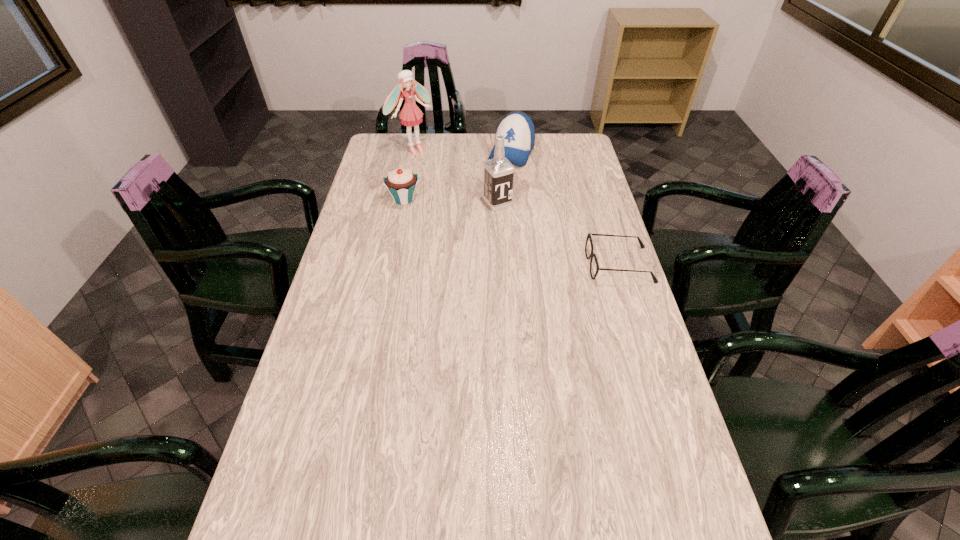
I want to click on vacant space situated on the front-facing side of the baseball cap, so click(x=474, y=232).

At what (x,y) coordinates should I click in order to perform the action: click on free location located on the front-facing side of the baseball cap. Please return your answer as a coordinate pair (x, y). Image resolution: width=960 pixels, height=540 pixels. Looking at the image, I should click on (483, 214).

At what (x,y) coordinates should I click in order to perform the action: click on vacant space located on the front-facing side of the baseball cap. Please return your answer as a coordinate pair (x, y). Looking at the image, I should click on (482, 218).

Where is `blank space located on the front label of the vodka`? The width and height of the screenshot is (960, 540). blank space located on the front label of the vodka is located at coordinates (548, 264).

You are a GUI agent. You are given a task and a screenshot of the screen. Output one action in this format:
    pyautogui.click(x=<x>, y=<y>)
    Task: Click on the free space located 0.390m on the front label of the vodka
    
    Given the screenshot: What is the action you would take?
    click(564, 282)

Find the location of `free space located on the front label of the vodka`. free space located on the front label of the vodka is located at coordinates (531, 243).

Where is `doll that is positioned at the far edge`? doll that is positioned at the far edge is located at coordinates (411, 115).

Identify the location of baseball cap at the far edge. This screenshot has width=960, height=540. (518, 129).

Locate an element on the screen. The width and height of the screenshot is (960, 540). cupcake present at the left edge is located at coordinates (401, 183).

This screenshot has width=960, height=540. What are the coordinates of `doll situated at the left edge` in the screenshot? It's located at (411, 115).